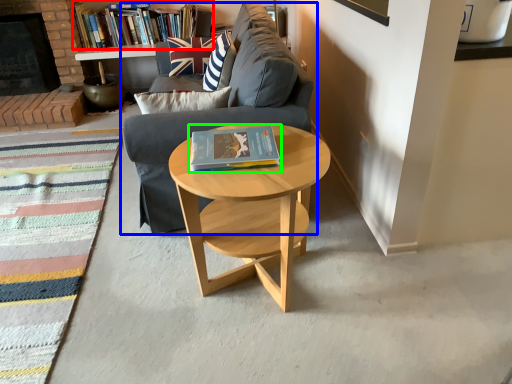
Question: Which is nearer to the book (highlighted by a red box)? studio couch (highlighted by a blue box) or book (highlighted by a green box).

Choices:
 (A) studio couch
 (B) book

Answer: (A)